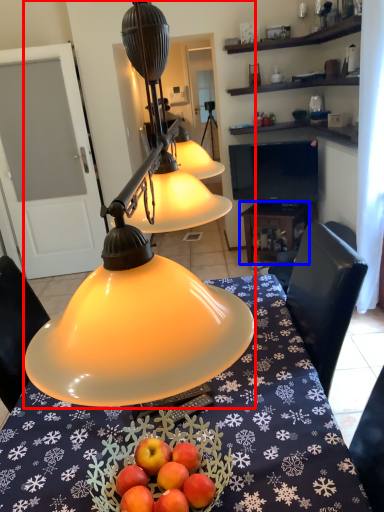
Question: Which object is further to the camera taking this photo, lamp (highlighted by a red box) or table (highlighted by a blue box)?

Choices:
 (A) lamp
 (B) table

Answer: (B)